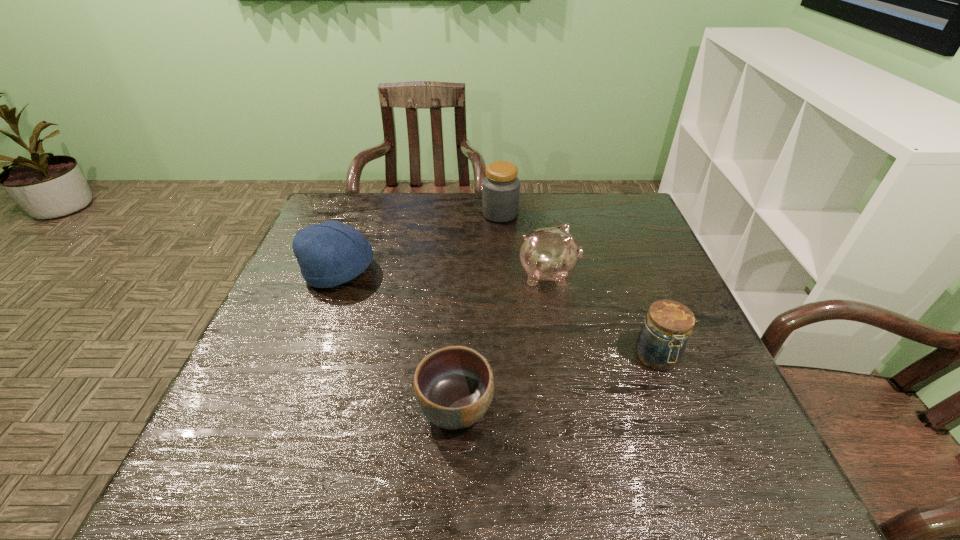
Image resolution: width=960 pixels, height=540 pixels. What are the coordinates of `vacant space at the right edge` in the screenshot? It's located at (646, 369).

In the image, there is a desktop. Identify the location of vacant space at the near left corner. This screenshot has height=540, width=960. (234, 494).

Locate an element on the screen. This screenshot has width=960, height=540. vacant space at the far right corner of the desktop is located at coordinates (619, 206).

Locate an element on the screen. empty space that is in between the piggy bank and the shortest object is located at coordinates (502, 341).

The height and width of the screenshot is (540, 960). I want to click on free spot between the shortest object and the left jar, so click(478, 310).

The width and height of the screenshot is (960, 540). I want to click on free space between the nearer jar and the bowl, so click(556, 382).

I want to click on free space between the piggy bank and the leftmost object, so click(x=444, y=273).

The image size is (960, 540). Find the location of `empty space that is in between the rightmost object and the piggy bank`. empty space that is in between the rightmost object and the piggy bank is located at coordinates (603, 316).

I want to click on vacant point located between the farthest object and the nearer jar, so click(x=579, y=286).

Where is `empty location between the farther jar and the rightmost object`? Image resolution: width=960 pixels, height=540 pixels. empty location between the farther jar and the rightmost object is located at coordinates (579, 286).